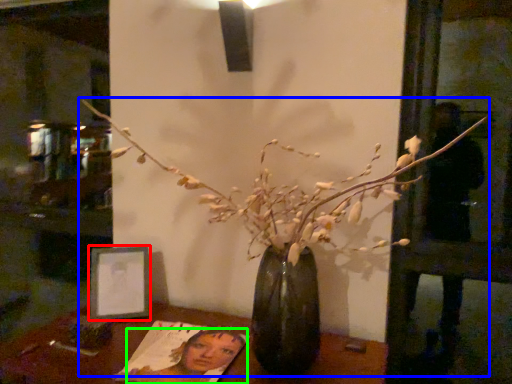
Question: Which object is the farthest from picture frame (highlighted by a red box)? Choose among these: houseplant (highlighted by a blue box) or woman (highlighted by a green box).

Choices:
 (A) houseplant
 (B) woman

Answer: (A)